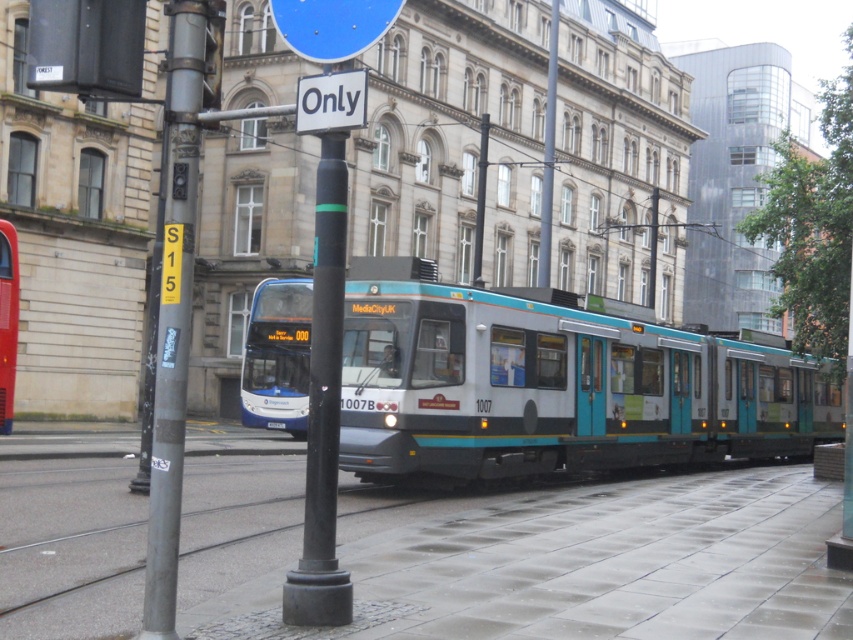
You are a pedestrian standing at the tram stop and see the blue metallic bus at center and the blue glossy sign at upper center. Which object is closer to your left side?

The blue metallic bus at center is to the left of the blue glossy sign at upper center, so it is closer to your left side.

You are a delivery person who needs to drive a van through the narrow alley between the teal glossy tram at center and the matte blue bus at center. The van is 2.5 meters wide. Can you safely pass through the alley without hitting either vehicle?

The teal glossy tram at center is much taller than the matte blue bus at center, but the description does not provide information about the width of the alley between them. Therefore, it is impossible to determine if the van can safely pass through based on the given details.